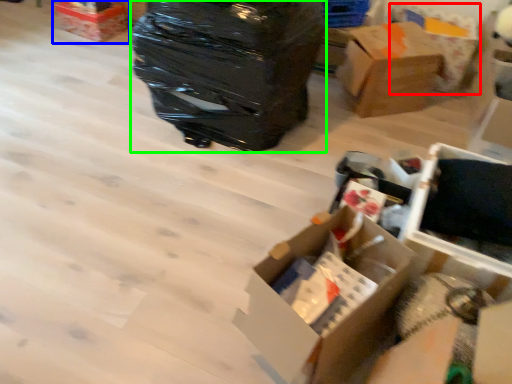
Question: Estimate the real-world distances between objects in this image. Which object is farther from cardboard box (highlighted by a red box), box (highlighted by a blue box) or garbage (highlighted by a green box)?

Choices:
 (A) box
 (B) garbage

Answer: (A)